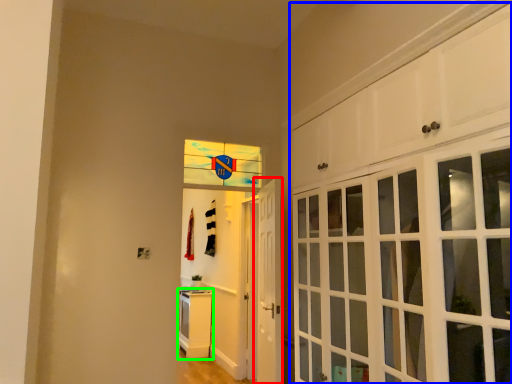
Question: Which object is the farthest from door (highlighted by a red box)? Choose among these: cabinetry (highlighted by a blue box) or cabinetry (highlighted by a green box).

Choices:
 (A) cabinetry
 (B) cabinetry

Answer: (B)